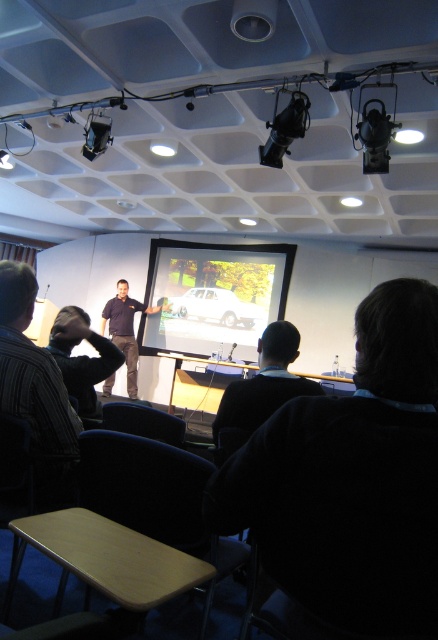
Which is more to the left, dark brown sweater at center or black plastic projector at upper left?

From the viewer's perspective, black plastic projector at upper left appears more on the left side.

Is point (399, 420) farther from viewer compared to point (99, 122)?

No, it is not.

Find the location of a particular element. This screenshot has width=438, height=640. dark brown sweater at center is located at coordinates (352, 477).

This screenshot has width=438, height=640. Describe the element at coordinates (81, 356) in the screenshot. I see `dark gray shirt at left` at that location.

Can you confirm if dark gray shirt at left is positioned to the right of black plastic projector at upper left?

Indeed, dark gray shirt at left is positioned on the right side of black plastic projector at upper left.

Is point (117, 365) in front of point (102, 150)?

That is True.

Find the location of a particular element. dark gray shirt at left is located at coordinates (81, 356).

Does matte white screen at center appear over black plastic projector at upper left?

Actually, matte white screen at center is below black plastic projector at upper left.

Can you confirm if matte white screen at center is smaller than black plastic projector at upper left?

Incorrect, matte white screen at center is not smaller in size than black plastic projector at upper left.

Does point (276, 244) come behind point (98, 134)?

Yes, point (276, 244) is farther from viewer.

I want to click on matte white screen at center, so click(x=214, y=294).